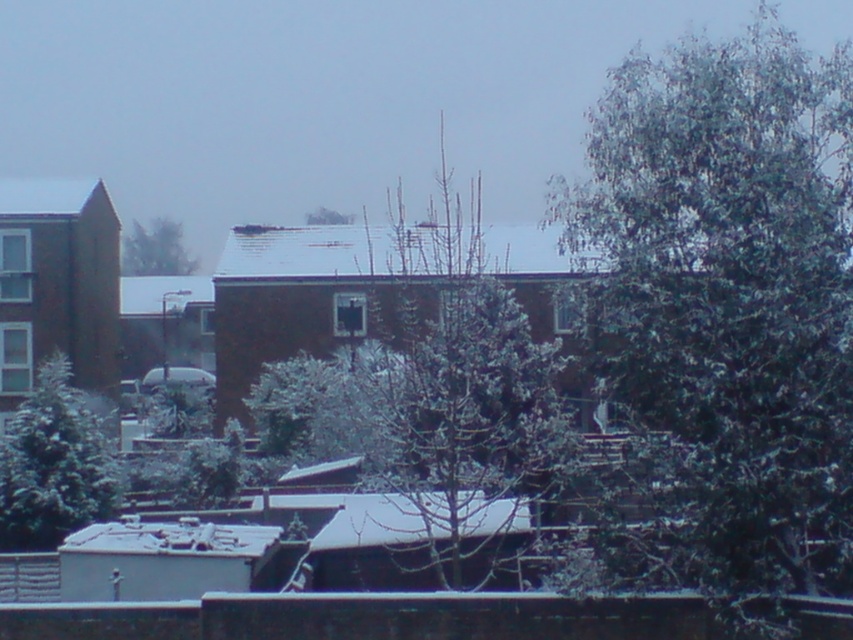
Which of these two, snow-covered tree at center or snowy evergreen tree at upper left, stands taller?

Standing taller between the two is snow-covered tree at center.

Between point (393, 332) and point (184, 252), which one is positioned in front?

Positioned in front is point (393, 332).

Is point (500, 394) more distant than point (143, 273)?

No, it is not.

At what (x,y) coordinates should I click in order to perform the action: click on snow-covered tree at center. Please return your answer as a coordinate pair (x, y). This screenshot has height=640, width=853. Looking at the image, I should click on (467, 385).

Is white fluffy tree at right thinner than green frosted tree at center?

In fact, white fluffy tree at right might be wider than green frosted tree at center.

Can you confirm if white fluffy tree at right is positioned to the right of green frosted tree at center?

Correct, you'll find white fluffy tree at right to the right of green frosted tree at center.

This screenshot has height=640, width=853. What do you see at coordinates (726, 314) in the screenshot? I see `white fluffy tree at right` at bounding box center [726, 314].

Identify the location of white fluffy tree at right. The width and height of the screenshot is (853, 640). (726, 314).

Is white fluffy tree at right below snowy evergreen tree at upper left?

No.

Locate an element on the screen. The image size is (853, 640). white fluffy tree at right is located at coordinates (726, 314).